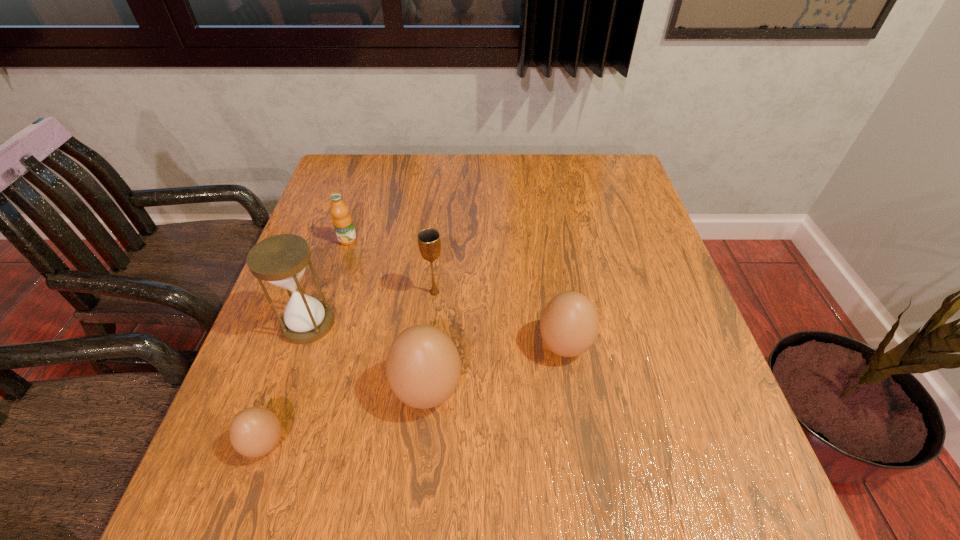
Locate an element on the screen. Image resolution: width=960 pixels, height=540 pixels. the leftmost boiled egg is located at coordinates (255, 431).

Where is `the shortest object`? the shortest object is located at coordinates (255, 431).

Find the location of a particular element. The image size is (960, 540). the second boiled egg from left to right is located at coordinates (423, 367).

At what (x,y) coordinates should I click in order to perform the action: click on the second tallest boiled egg. Please return your answer as a coordinate pair (x, y). Looking at the image, I should click on (569, 324).

Find the location of a particular element. The image size is (960, 540). the rightmost boiled egg is located at coordinates (569, 324).

Identify the location of the farthest object. (342, 221).

This screenshot has width=960, height=540. Find the location of `the fifth nearest object`. the fifth nearest object is located at coordinates (429, 242).

Where is `hourglass`? hourglass is located at coordinates (281, 260).

Image resolution: width=960 pixels, height=540 pixels. In order to click on free point located on the right of the shortest object in this screenshot , I will do `click(508, 444)`.

Where is `free space located on the back of the second boiled egg from right to left`? Image resolution: width=960 pixels, height=540 pixels. free space located on the back of the second boiled egg from right to left is located at coordinates (440, 259).